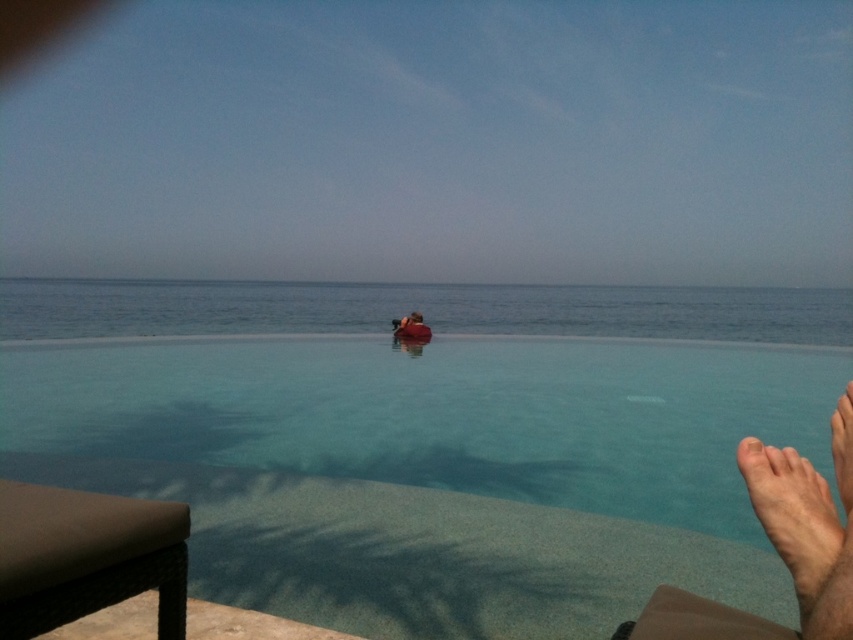
Question: Which object is the closest to the clear blue water at center?

Choices:
 (A) skinny barefoot at lower right
 (B) dark brown leather chair at center

Answer: (B)

Question: Is skinny barefoot at lower right positioned behind dark brown leather chair at center?

Choices:
 (A) no
 (B) yes

Answer: (A)

Question: Which point is closer to the camera?

Choices:
 (A) (561, 308)
 (B) (753, 483)
 (C) (416, 333)

Answer: (B)

Question: Observing the image, what is the correct spatial positioning of clear blue water at center in reference to skinny barefoot at lower right?

Choices:
 (A) above
 (B) below

Answer: (A)

Question: Does clear blue water at center appear under dark brown leather chair at center?

Choices:
 (A) no
 (B) yes

Answer: (A)

Question: Which object is closer to the camera taking this photo?

Choices:
 (A) dark brown leather chair at center
 (B) skinny barefoot at lower right

Answer: (B)